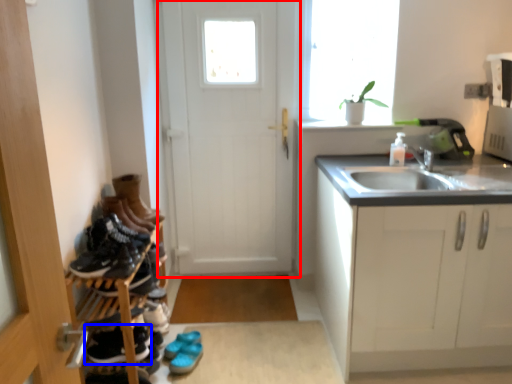
Question: Among these objects, which one is farthest to the camera, door (highlighted by a red box) or footwear (highlighted by a blue box)?

Choices:
 (A) door
 (B) footwear

Answer: (A)